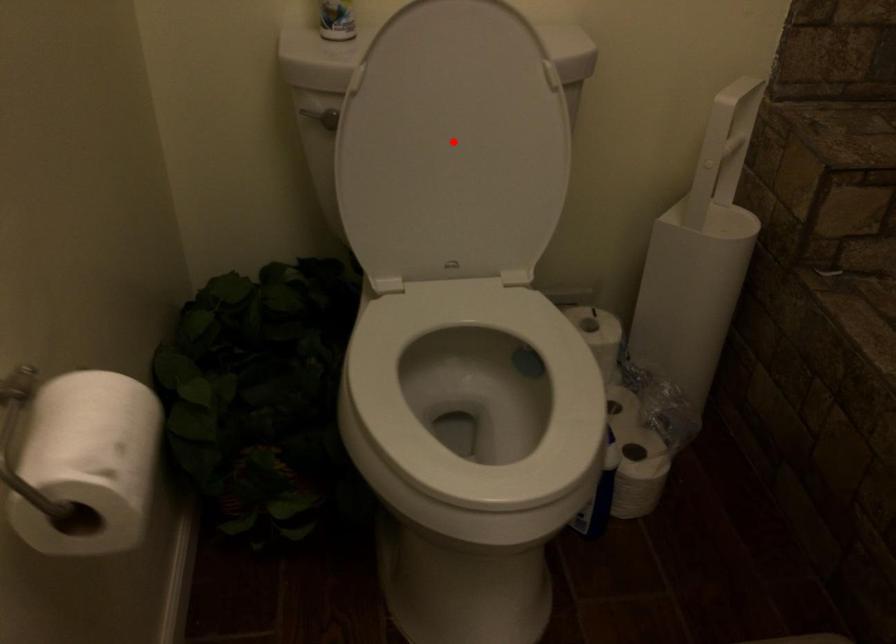
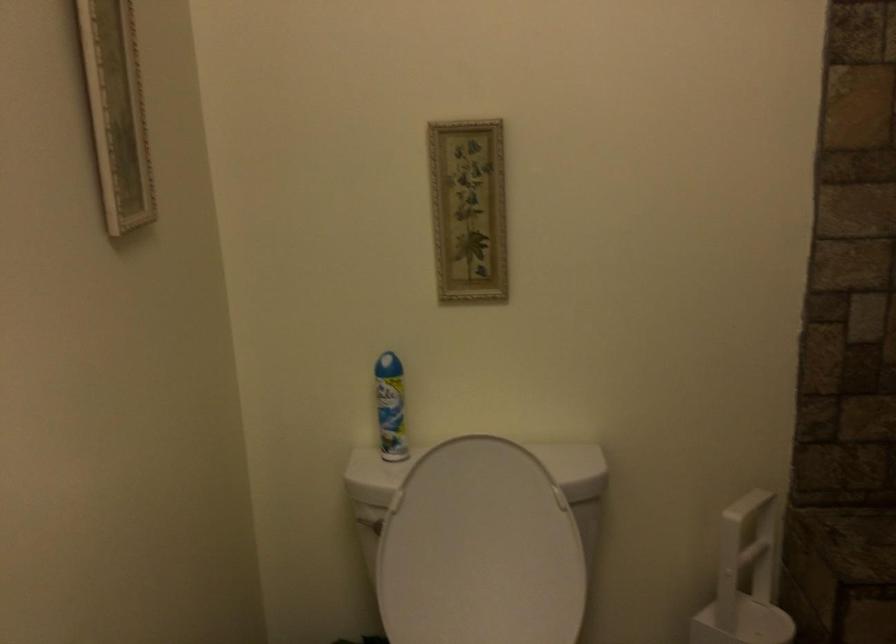
Locate, in the second image, the point that corresponds to the highlighted location in the first image.

(479, 550)